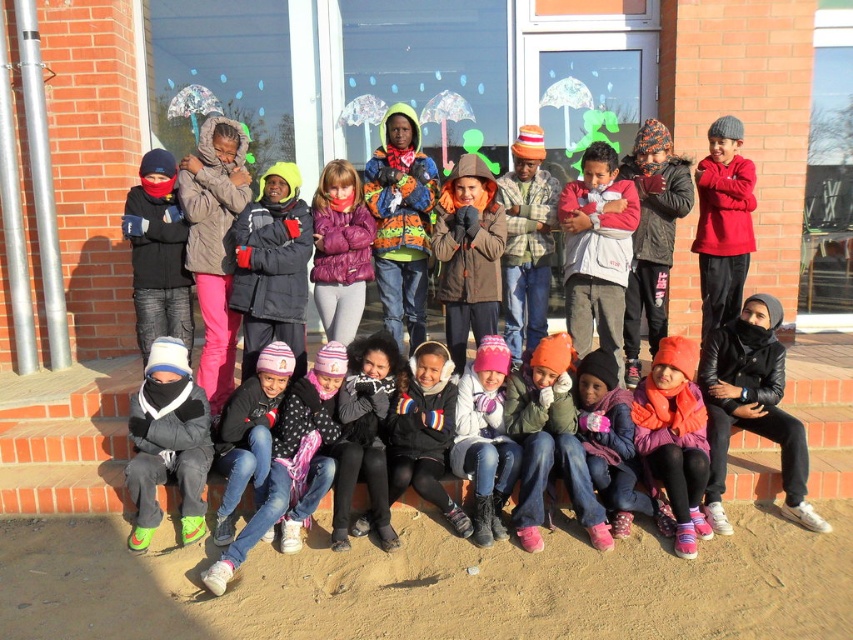
Question: Which point is farther from the camera taking this photo?

Choices:
 (A) (495, 378)
 (B) (317, 256)

Answer: (B)

Question: Among these points, which one is farthest from the camera?

Choices:
 (A) (714, 342)
 (B) (468, 440)
 (C) (345, 323)
 (D) (636, 435)

Answer: (C)

Question: Estimate the real-world distances between objects in this image. Which object is farther from the purple puffy jacket at center?

Choices:
 (A) black leather jacket at lower right
 (B) orange fleece scarf at center

Answer: (A)

Question: Is black leather jacket at lower right positioned before purple puffy jacket at center?

Choices:
 (A) yes
 (B) no

Answer: (A)

Question: Can you confirm if black leather jacket at lower right is bigger than pink woolen hat at center?

Choices:
 (A) yes
 (B) no

Answer: (A)

Question: Is the position of black leather jacket at lower right less distant than that of orange fleece scarf at center?

Choices:
 (A) yes
 (B) no

Answer: (B)